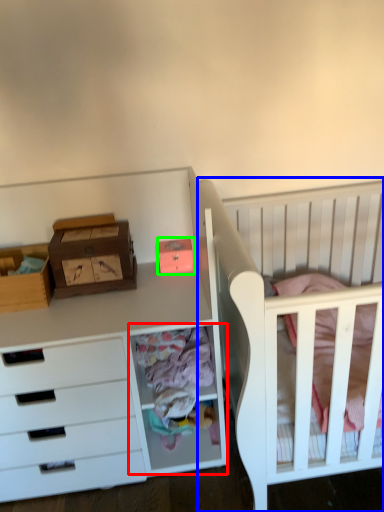
Question: Which object is positioned farthest from cabinet (highlighted by a red box)? Select from infant bed (highlighted by a blue box) and storage box (highlighted by a green box).

Choices:
 (A) infant bed
 (B) storage box

Answer: (B)